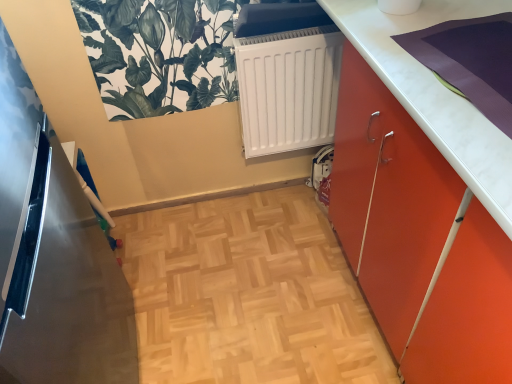
Question: Based on their sizes in the image, would you say metallic refrigerator at left is bigger or smaller than white matte radiator at center?

Choices:
 (A) small
 (B) big

Answer: (B)

Question: Which is correct: metallic refrigerator at left is inside white matte radiator at center, or outside of it?

Choices:
 (A) outside
 (B) inside

Answer: (A)

Question: Which object is positioned farthest from the metallic refrigerator at left?

Choices:
 (A) green leafy plant at upper left
 (B) white matte radiator at center
 (C) orange matte cabinet at right

Answer: (C)

Question: Estimate the real-world distances between objects in this image. Which object is farther from the white matte radiator at center?

Choices:
 (A) metallic refrigerator at left
 (B) orange matte cabinet at right
 (C) green leafy plant at upper left

Answer: (A)